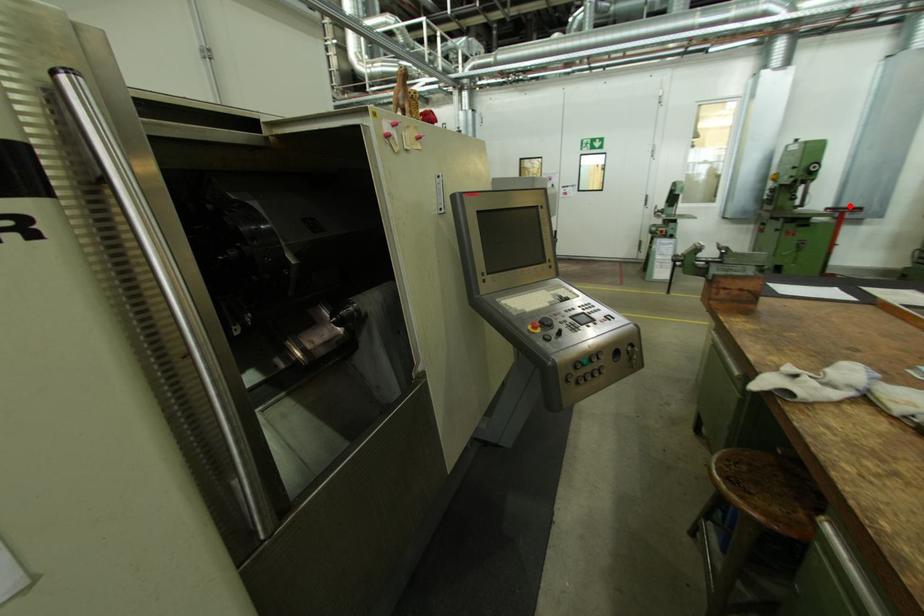
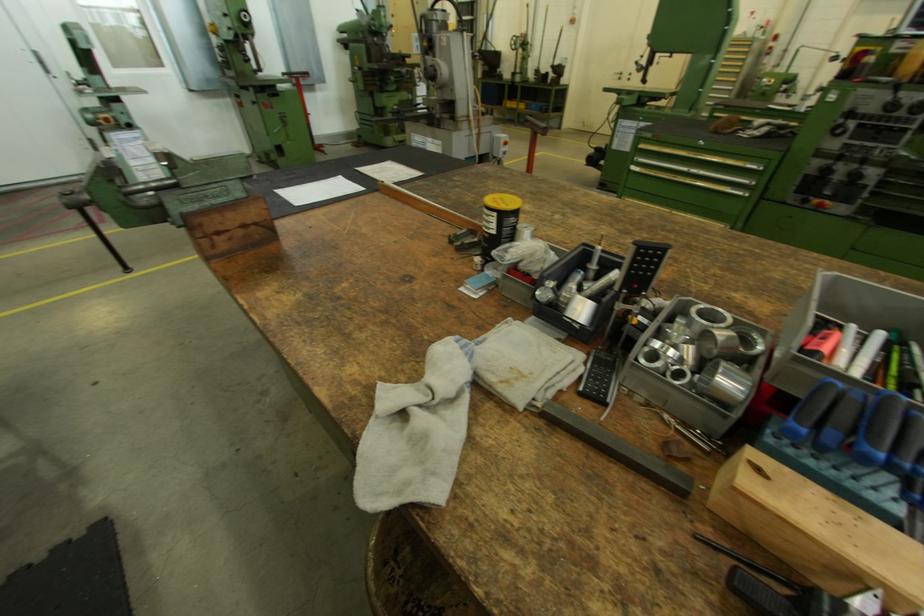
Find the pixel in the second image that matches the highlighted location in the first image.

(299, 71)